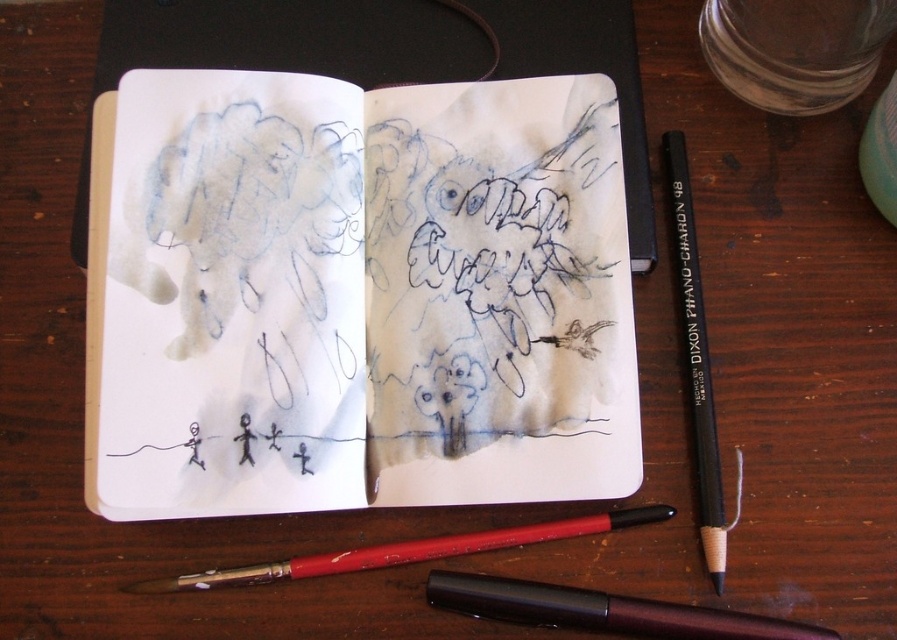
You are an artist who needs to choose a pencil for shading. You see the red wood pencil at lower center and the black pencil at right. Which pencil is positioned more to the left side of the wooden surface?

The red wood pencil at lower center is positioned more to the left side of the wooden surface than the black pencil at right.

You are an artist trying to locate your metallic burgundy pen. You see the open sketchbook and the metallic burgundy pen at lower center. Based on the coordinates provided, can you determine if the pen is closer to the edge of the wooden surface or the center?

The metallic burgundy pen at lower center is located at coordinates point (602, 611), which places it closer to the edge of the wooden surface rather than the center.